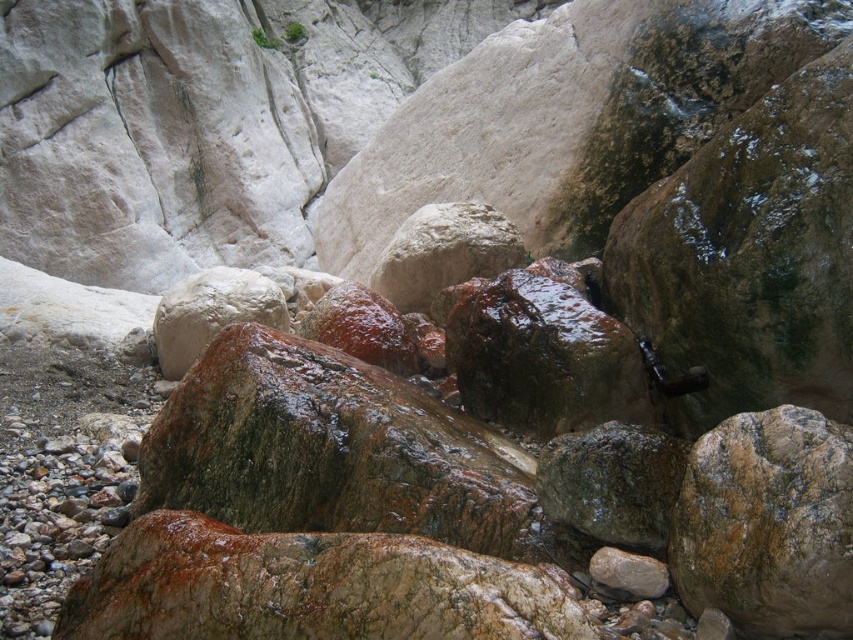
You are a hiker trying to navigate through the rocky canyon. You see a brown rough rock at center and a rusty metallic rock at center. Which rock is positioned lower in the scene?

The brown rough rock at center is positioned lower than the rusty metallic rock at center, so it is the lower one.

You are standing at the point marked by the coordinates point (767, 524) in the rocky canyon scene. What type of rock are you standing on?

You are standing on a brown rough rock at center as indicated by the coordinates point (767, 524).

You are a geologist examining the rocky canyon scene. You see the brown rough rock at center and the rusty metallic rock at center. Which rock is located to the right of the other?

The brown rough rock at center is positioned on the right side of rusty metallic rock at center, so the brown rough rock at center is to the right of the rusty metallic rock at center.